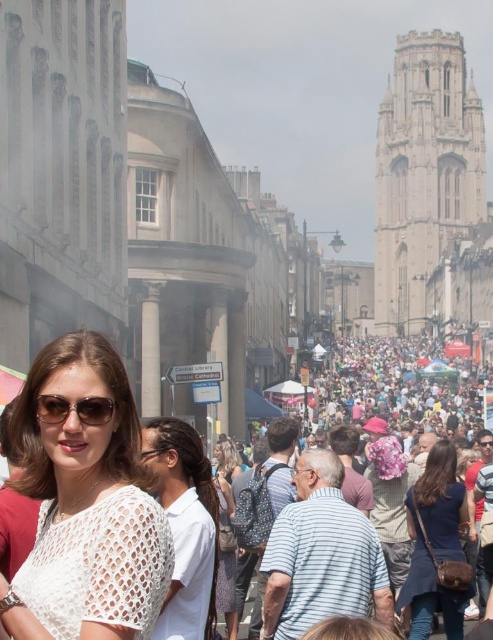
Question: Which of these objects is positioned closest to the sunglasses at center?

Choices:
 (A) white crochet top at center
 (B) stone tower at upper right

Answer: (A)

Question: Which object appears farthest from the camera in this image?

Choices:
 (A) white crochet top at lower left
 (B) stone tower at upper right
 (C) sunglasses at center
 (D) transparent plastic glasses at center

Answer: (B)

Question: Is stone tower at upper right smaller than black plastic goggles at upper center?

Choices:
 (A) yes
 (B) no

Answer: (B)

Question: Does white crochet top at center have a larger size compared to dark blue fabric dress at lower right?

Choices:
 (A) no
 (B) yes

Answer: (A)

Question: Which object is positioned closest to the sunglasses at center?

Choices:
 (A) transparent plastic glasses at center
 (B) black plastic goggles at upper center
 (C) white crochet top at lower left
 (D) stone tower at upper right

Answer: (C)

Question: Does stone tower at upper right have a larger size compared to sunglasses at center?

Choices:
 (A) no
 (B) yes

Answer: (B)